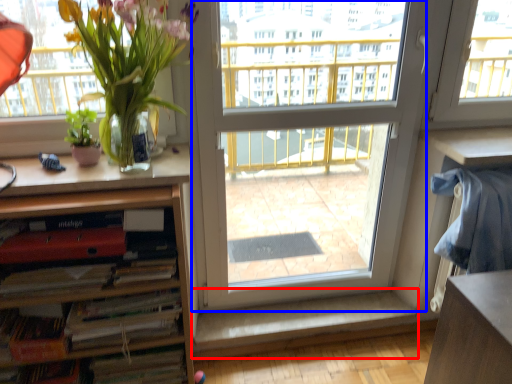
Question: Which of the following is the farthest to the observer, window sill (highlighted by a red box) or screen door (highlighted by a blue box)?

Choices:
 (A) window sill
 (B) screen door

Answer: (A)